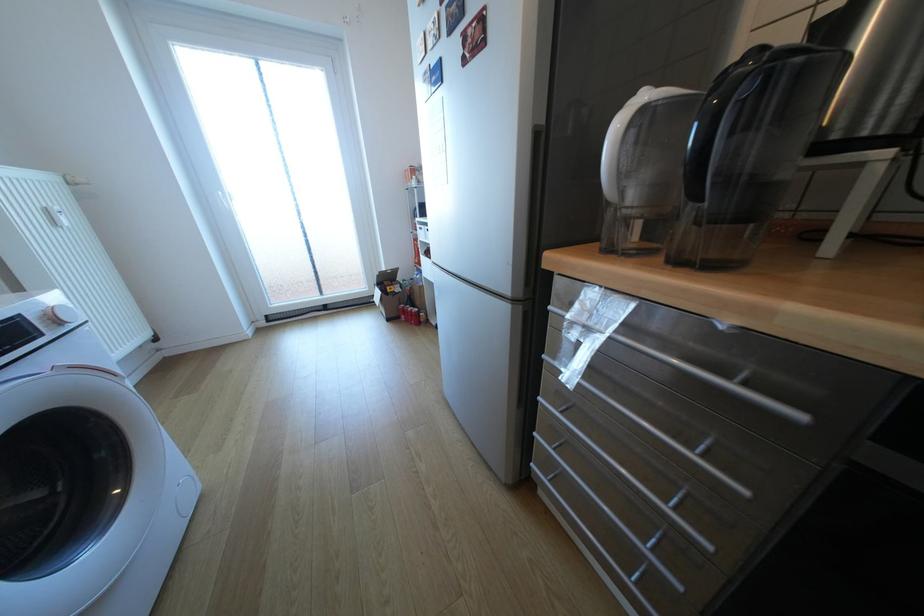
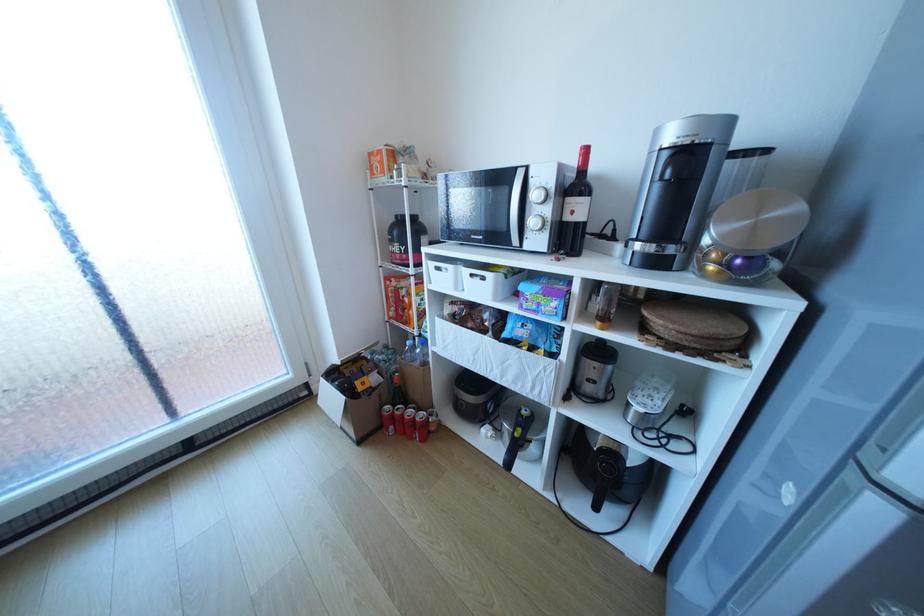
The point at (x=430, y=229) is marked in the first image. Where is the corresponding point in the second image?

(446, 268)